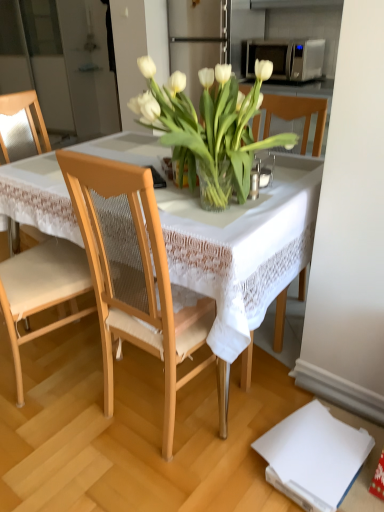
Question: Is light wood chair at center, which appears as the first chair when viewed from the front, spatially inside light wood mesh chair at left, which is counted as the second chair, starting from the right, or outside of it?

Choices:
 (A) outside
 (B) inside

Answer: (A)

Question: From their relative heights in the image, would you say light wood chair at center, which appears as the second chair when viewed from the back, is taller or shorter than light wood mesh chair at left, which ranks as the first chair in left-to-right order?

Choices:
 (A) tall
 (B) short

Answer: (B)

Question: Estimate the real-world distances between objects in this image. Which object is closer to the translucent glass vase at center?

Choices:
 (A) light wood chair at center, which appears as the first chair when viewed from the front
 (B) satin silver microwave at upper right
 (C) white lace tablecloth at center
 (D) light wood mesh chair at left, marked as the first chair in a back-to-front arrangement

Answer: (C)

Question: Estimate the real-world distances between objects in this image. Which object is closer to the translucent glass vase at center?

Choices:
 (A) satin silver microwave at upper right
 (B) light wood chair at center, which ranks as the second chair in left-to-right order
 (C) white lace tablecloth at center
 (D) light wood mesh chair at left, acting as the 2th chair starting from the front

Answer: (C)